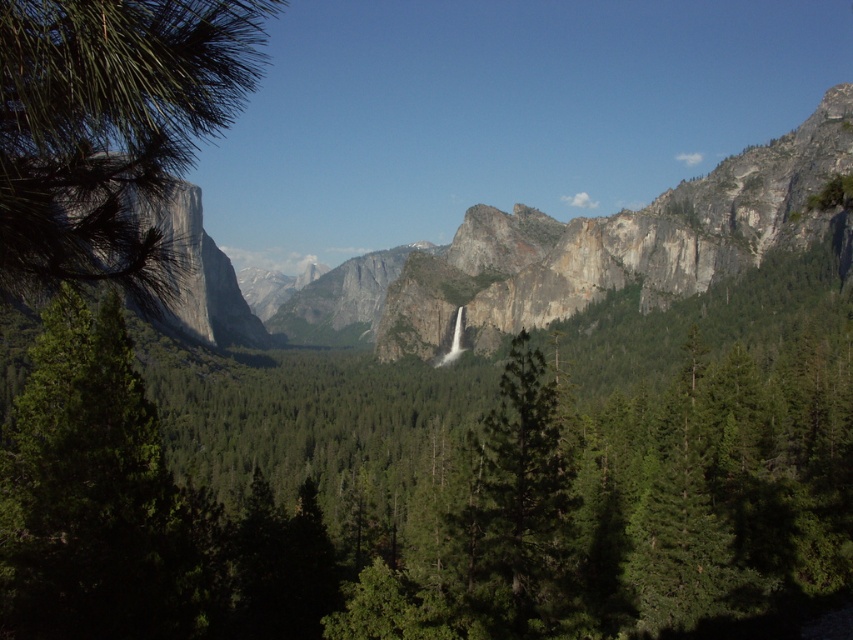
You are standing at the edge of the forest and want to reach the green matte pine forest at center. In which direction should you walk to reach it?

The green matte pine forest at center is located at coordinates 0.747 on the x axis and 0.513 on the y axis, so you should walk towards the center of the image to reach it.